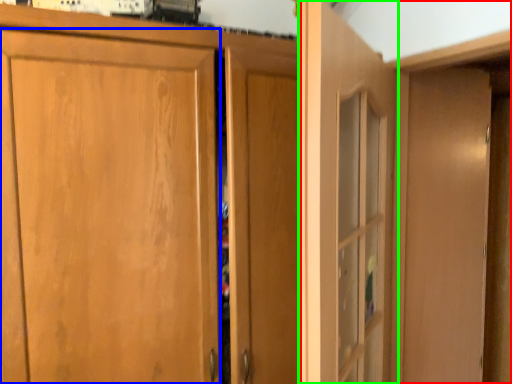
Question: Which is nearer to the dresser (highlighted by a red box)? door (highlighted by a blue box) or door (highlighted by a green box).

Choices:
 (A) door
 (B) door

Answer: (B)